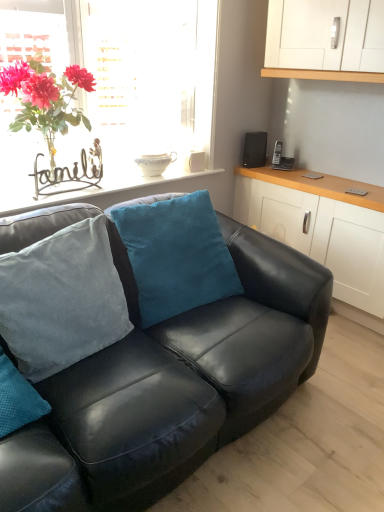
Question: Can you confirm if glass vase at upper left is taller than black matte speaker at upper right?

Choices:
 (A) yes
 (B) no

Answer: (A)

Question: Is the position of glass vase at upper left less distant than that of black matte speaker at upper right?

Choices:
 (A) yes
 (B) no

Answer: (A)

Question: Is the position of glass vase at upper left more distant than that of black matte speaker at upper right?

Choices:
 (A) yes
 (B) no

Answer: (B)

Question: From the image's perspective, is glass vase at upper left above black matte speaker at upper right?

Choices:
 (A) no
 (B) yes

Answer: (B)

Question: Is glass vase at upper left outside of black matte speaker at upper right?

Choices:
 (A) yes
 (B) no

Answer: (A)

Question: From the image's perspective, is white matte cabinet at right above or below teal velvety pillow at center, placed as the second pillow when sorted from left to right?

Choices:
 (A) below
 (B) above

Answer: (B)

Question: Is white matte cabinet at right spatially inside teal velvety pillow at center, placed as the second pillow when sorted from left to right, or outside of it?

Choices:
 (A) outside
 (B) inside

Answer: (A)

Question: Looking at their shapes, would you say white matte cabinet at right is wider or thinner than teal velvety pillow at center, placed as the second pillow when sorted from left to right?

Choices:
 (A) thin
 (B) wide

Answer: (B)

Question: From their relative heights in the image, would you say white matte cabinet at right is taller or shorter than teal velvety pillow at center, the first pillow in the right-to-left sequence?

Choices:
 (A) short
 (B) tall

Answer: (B)

Question: Is teal velvety pillow at center, placed as the second pillow when sorted from left to right, taller or shorter than black matte speaker at upper right?

Choices:
 (A) tall
 (B) short

Answer: (A)

Question: Visually, is teal velvety pillow at center, placed as the second pillow when sorted from left to right, positioned to the left or to the right of black matte speaker at upper right?

Choices:
 (A) left
 (B) right

Answer: (A)

Question: In terms of width, does teal velvety pillow at center, placed as the second pillow when sorted from left to right, look wider or thinner when compared to black matte speaker at upper right?

Choices:
 (A) thin
 (B) wide

Answer: (B)

Question: From a real-world perspective, is teal velvety pillow at center, the first pillow in the right-to-left sequence, positioned above or below black matte speaker at upper right?

Choices:
 (A) above
 (B) below

Answer: (B)

Question: From the image's perspective, is white ceramic bowl at upper center above or below velvet blue pillow at center, placed as the second pillow when sorted from right to left?

Choices:
 (A) above
 (B) below

Answer: (A)

Question: Based on their positions, is white ceramic bowl at upper center located to the left or right of velvet blue pillow at center, placed as the second pillow when sorted from right to left?

Choices:
 (A) left
 (B) right

Answer: (A)